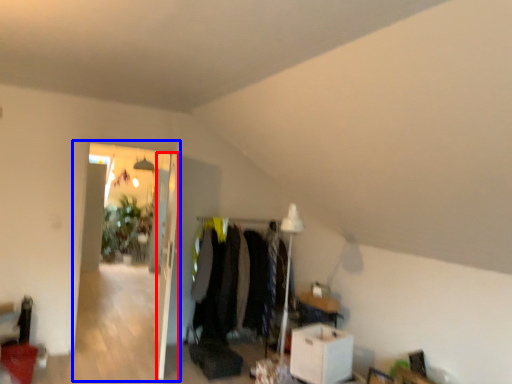
Question: Among these objects, which one is farthest to the camera, door (highlighted by a red box) or glass door (highlighted by a blue box)?

Choices:
 (A) door
 (B) glass door

Answer: (B)